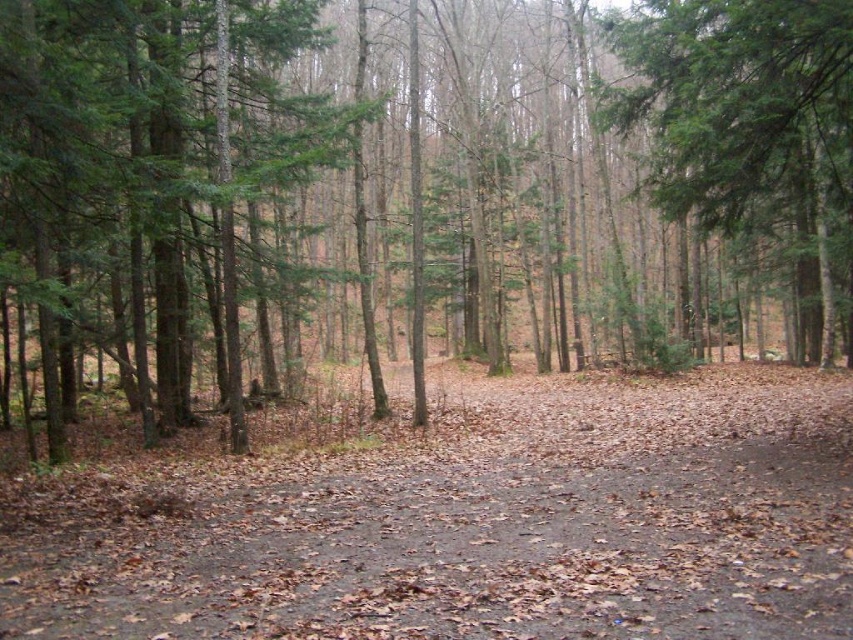
Is green matte tree at center thinner than green matte tree at upper right?

Incorrect, green matte tree at center's width is not less than green matte tree at upper right's.

Which is behind, point (49, 314) or point (680, 36)?

Positioned behind is point (680, 36).

Who is more distant from viewer, (45, 173) or (717, 38)?

The point (717, 38) is more distant.

What are the coordinates of `green matte tree at center` in the screenshot? It's located at (416, 186).

Who is positioned more to the right, brown dirt trail at center or green matte tree at upper right?

From the viewer's perspective, green matte tree at upper right appears more on the right side.

Does brown dirt trail at center lie in front of green matte tree at upper right?

Yes, brown dirt trail at center is closer to the viewer.

Is point (698, 616) in front of point (788, 196)?

That is True.

This screenshot has width=853, height=640. What are the coordinates of `brown dirt trail at center` in the screenshot? It's located at (465, 520).

Is green matte tree at center wider than brown dirt trail at center?

Yes.

Is point (265, 144) positioned in front of point (428, 368)?

Yes, point (265, 144) is closer to viewer.

The image size is (853, 640). Find the location of `green matte tree at center`. green matte tree at center is located at coordinates (416, 186).